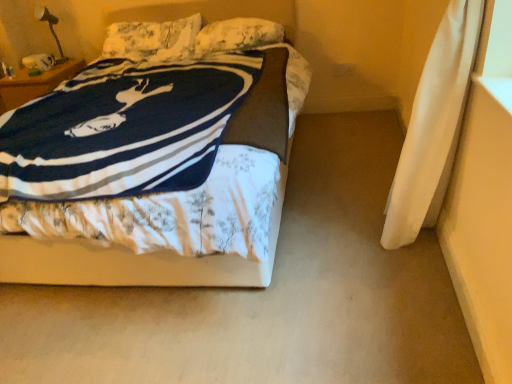
Question: From the image's perspective, is fluffy white pillow at upper center, arranged as the first pillow when viewed from the left, positioned above or below fluffy white pillow at upper center, which is the second pillow from left to right?

Choices:
 (A) below
 (B) above

Answer: (B)

Question: Is fluffy white pillow at upper center, arranged as the 2th pillow when viewed from the right, in front of or behind fluffy white pillow at upper center, the 1th pillow when ordered from right to left, in the image?

Choices:
 (A) behind
 (B) front

Answer: (A)

Question: Estimate the real-world distances between objects in this image. Which object is farther from the fluffy white pillow at upper center, arranged as the first pillow when viewed from the left?

Choices:
 (A) white floral fabric bed at center
 (B) fluffy white pillow at upper center, the 1th pillow when ordered from right to left

Answer: (A)

Question: Based on their relative distances, which object is farther from the fluffy white pillow at upper center, which is the second pillow from left to right?

Choices:
 (A) fluffy white pillow at upper center, arranged as the 2th pillow when viewed from the right
 (B) white floral fabric bed at center

Answer: (B)